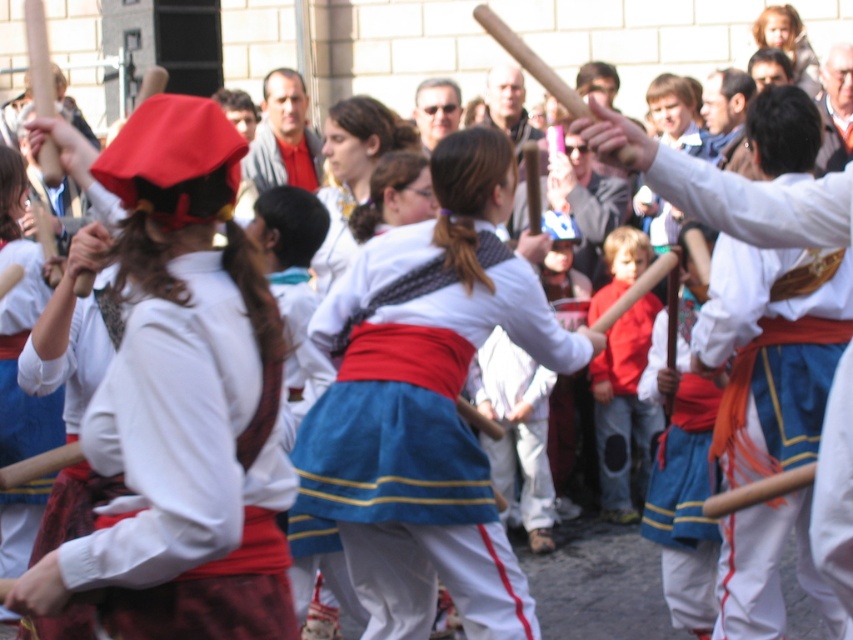
You are standing at the center of the courtyard and see the blue cotton skirt at center. Which direction should you move to get closer to it?

Since the blue cotton skirt at center is located at point 0.709 on the x and 0.499 on the y, you should move forward slightly to the right to reach it.

You are a photographer at the festival and want to capture the traditional attire of the performers. Which object should you focus on first if you need to ensure both the blue cotton skirt at center and the red cotton shirt at center are in frame?

The blue cotton skirt at center is below the red cotton shirt at center, so focusing on the red cotton shirt at center first will ensure both are in frame as the skirt is positioned lower.